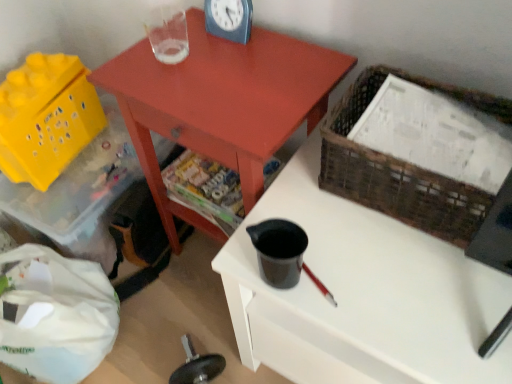
Find the location of `woven brown basket at upper right, the first basket viewed from the front`. woven brown basket at upper right, the first basket viewed from the front is located at coordinates (399, 162).

In order to click on yellow plastic storage box at lower left in this screenshot , I will do `click(77, 198)`.

Where is `black plastic cup at center`? The width and height of the screenshot is (512, 384). black plastic cup at center is located at coordinates (362, 295).

In order to face blue plastic clock at upper center, should I rotate leftwards or rightwards?

To face it directly, rotate left by 4.293 degrees.

Locate an element on the screen. blue plastic clock at upper center is located at coordinates (229, 19).

You are a GUI agent. You are given a task and a screenshot of the screen. Output one action in this format:
    pyautogui.click(x=<x>, y=<y>)
    Task: Click on the woven brown basket at upper right, which is the second basket in left-to-right order
    The width and height of the screenshot is (512, 384).
    Given the screenshot: What is the action you would take?
    pyautogui.click(x=399, y=162)

Which object is wider, black plastic cup at center or matte red table at center?

Wider between the two is black plastic cup at center.

In terms of height, does black plastic cup at center look taller or shorter compared to matte red table at center?

Clearly, black plastic cup at center is shorter compared to matte red table at center.

In the image, is black plastic cup at center positioned in front of or behind matte red table at center?

In the image, black plastic cup at center appears in front of matte red table at center.

Considering the sizes of objects woven brown basket at upper right, the first basket viewed from the front, and yellow plastic basket at lower left, which is counted as the first basket, starting from the left, in the image provided, who is shorter, woven brown basket at upper right, the first basket viewed from the front, or yellow plastic basket at lower left, which is counted as the first basket, starting from the left,?

Standing shorter between the two is woven brown basket at upper right, the first basket viewed from the front.

Is woven brown basket at upper right, which is the second basket in left-to-right order, beside yellow plastic basket at lower left, which is counted as the first basket, starting from the left?

No, woven brown basket at upper right, which is the second basket in left-to-right order, is not with yellow plastic basket at lower left, which is counted as the first basket, starting from the left.

In the scene shown: Is the depth of woven brown basket at upper right, the 2th basket from the back, greater than that of yellow plastic basket at lower left, acting as the second basket starting from the right?

No, it is not.

Which point is more forward, (x=504, y=116) or (x=14, y=166)?

Positioned in front is point (x=504, y=116).

Is woven brown basket at upper right, which is the second basket in left-to-right order, at the right side of blue plastic clock at upper center?

Yes.

Based on the photo, what's the angular difference between woven brown basket at upper right, which is the second basket in left-to-right order, and blue plastic clock at upper center's facing directions?

They differ by 3.25 degrees in their facing directions.

Is woven brown basket at upper right, the first basket viewed from the front, positioned before blue plastic clock at upper center?

Yes, it is.

Based on their sizes in the image, would you say yellow plastic storage box at lower left is bigger or smaller than blue plastic clock at upper center?

Considering their sizes, yellow plastic storage box at lower left takes up more space than blue plastic clock at upper center.

Measure the distance from yellow plastic storage box at lower left to blue plastic clock at upper center.

yellow plastic storage box at lower left is 24.65 inches away from blue plastic clock at upper center.

You are a GUI agent. You are given a task and a screenshot of the screen. Output one action in this format:
    pyautogui.click(x=<x>, y=<y>)
    Task: Click on the storage box below the blue plastic clock at upper center (from the image's perspective)
    The image size is (512, 384).
    Given the screenshot: What is the action you would take?
    pyautogui.click(x=77, y=198)

Are yellow plastic storage box at lower left and blue plastic clock at upper center beside each other?

No, yellow plastic storage box at lower left is not with blue plastic clock at upper center.

Is black plastic cup at center looking in the opposite direction of yellow plastic basket at lower left, which is counted as the first basket, starting from the left?

black plastic cup at center does not have its back to yellow plastic basket at lower left, which is counted as the first basket, starting from the left.

From the image's perspective, which one is positioned higher, black plastic cup at center or yellow plastic basket at lower left, acting as the second basket starting from the right?

yellow plastic basket at lower left, acting as the second basket starting from the right, is shown above in the image.

Would you say black plastic cup at center is a long distance from yellow plastic basket at lower left, acting as the second basket starting from the right?

black plastic cup at center is near yellow plastic basket at lower left, acting as the second basket starting from the right, not far away.

Considering the sizes of objects black plastic cup at center and yellow plastic basket at lower left, the second basket positioned from the front, in the image provided, who is taller, black plastic cup at center or yellow plastic basket at lower left, the second basket positioned from the front,?

Standing taller between the two is black plastic cup at center.

Considering the positions of points (206, 21) and (11, 118), is point (206, 21) farther from camera compared to point (11, 118)?

That is False.

Does blue plastic clock at upper center have a smaller size compared to yellow plastic basket at lower left, which is counted as the first basket, starting from the left?

Correct, blue plastic clock at upper center occupies less space than yellow plastic basket at lower left, which is counted as the first basket, starting from the left.

In terms of height, does blue plastic clock at upper center look taller or shorter compared to yellow plastic basket at lower left, which is counted as the first basket, starting from the left?

In the image, blue plastic clock at upper center appears to be shorter than yellow plastic basket at lower left, which is counted as the first basket, starting from the left.

Can you tell me how much blue plastic clock at upper center and yellow plastic basket at lower left, which is counted as the first basket, starting from the left, differ in facing direction?

They differ by 103 degrees in their facing directions.

Is yellow plastic storage box at lower left closer to camera compared to matte red table at center?

No.

Is yellow plastic storage box at lower left oriented away from matte red table at center?

No, yellow plastic storage box at lower left is not facing the opposite direction of matte red table at center.

The width and height of the screenshot is (512, 384). I want to click on table on the left of black plastic cup at center, so click(221, 104).

The width and height of the screenshot is (512, 384). I want to click on basket in front of the yellow plastic basket at lower left, which is counted as the first basket, starting from the left, so click(399, 162).

Considering their positions, is yellow plastic storage box at lower left positioned closer to matte red table at center than blue plastic clock at upper center?

blue plastic clock at upper center is closer to matte red table at center.

When comparing their distances from black plastic cup at center, does yellow plastic basket at lower left, acting as the second basket starting from the right, or yellow plastic storage box at lower left seem closer?

yellow plastic storage box at lower left.

Estimate the real-world distances between objects in this image. Which object is further from woven brown basket at upper right, the first basket viewed from the front, blue plastic clock at upper center or yellow plastic storage box at lower left?

Among the two, yellow plastic storage box at lower left is located further to woven brown basket at upper right, the first basket viewed from the front.

Based on their spatial positions, is yellow plastic basket at lower left, acting as the second basket starting from the right, or black plastic cup at center closer to blue plastic clock at upper center?

black plastic cup at center is positioned closer to the anchor blue plastic clock at upper center.

Considering their positions, is yellow plastic storage box at lower left positioned closer to blue plastic clock at upper center than woven brown basket at upper right, the first basket viewed from the front?

Among the two, woven brown basket at upper right, the first basket viewed from the front, is located nearer to blue plastic clock at upper center.

Based on their spatial positions, is matte red table at center or woven brown basket at upper right, the first basket viewed from the front, further from blue plastic clock at upper center?

The object further to blue plastic clock at upper center is woven brown basket at upper right, the first basket viewed from the front.

Looking at the image, which one is located closer to matte red table at center, black plastic cup at center or yellow plastic storage box at lower left?

black plastic cup at center is positioned closer to the anchor matte red table at center.

Considering their positions, is matte red table at center positioned further to yellow plastic basket at lower left, the second basket positioned from the front, than blue plastic clock at upper center?

blue plastic clock at upper center.

What are the coordinates of `storage box situated between yellow plastic basket at lower left, which is counted as the first basket, starting from the left, and black plastic cup at center from left to right` in the screenshot? It's located at (77, 198).

Find the location of a particular element. The height and width of the screenshot is (384, 512). clock between yellow plastic storage box at lower left and matte red table at center is located at coordinates (229, 19).

Locate an element on the screen. basket between matte red table at center and black plastic cup at center from left to right is located at coordinates (399, 162).

Identify the location of table located between yellow plastic basket at lower left, the second basket positioned from the front, and woven brown basket at upper right, which is the second basket in left-to-right order, in the left-right direction. (221, 104).